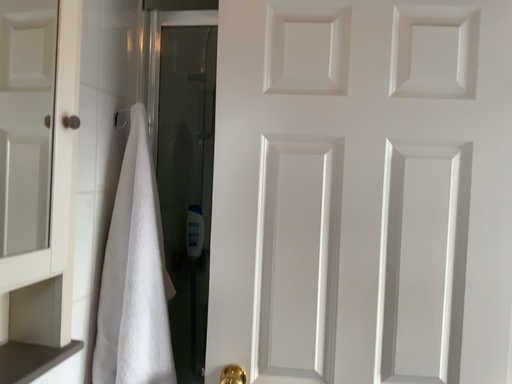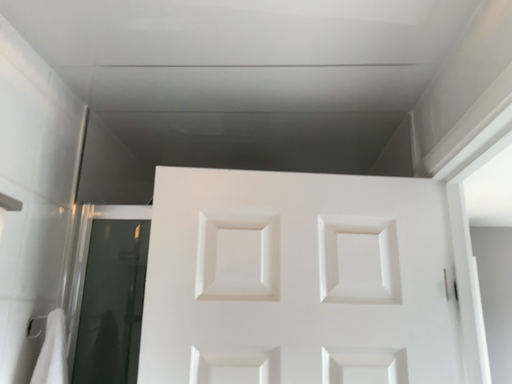
Question: Which way did the camera rotate in the video?

Choices:
 (A) rotated downward
 (B) rotated upward

Answer: (B)